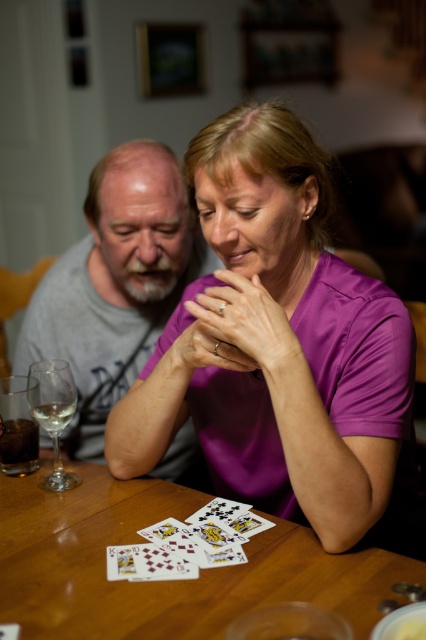
You are sitting at the table and want to reach for the point at position (83,602). Is this point closer to you than the other point at (172,540)?

Yes, the point at (83,602) is in front of the point at (172,540), so it is closer to you.

From the picture: You are a photographer standing in front of the scene. You want to take a photo of the purple satin shirt at center and the wooden table at center. Which object should you focus on if you want to capture both in the same frame without moving the camera?

The purple satin shirt at center is taller than the wooden table at center, so you should focus on the purple satin shirt at center to ensure both are in the frame.